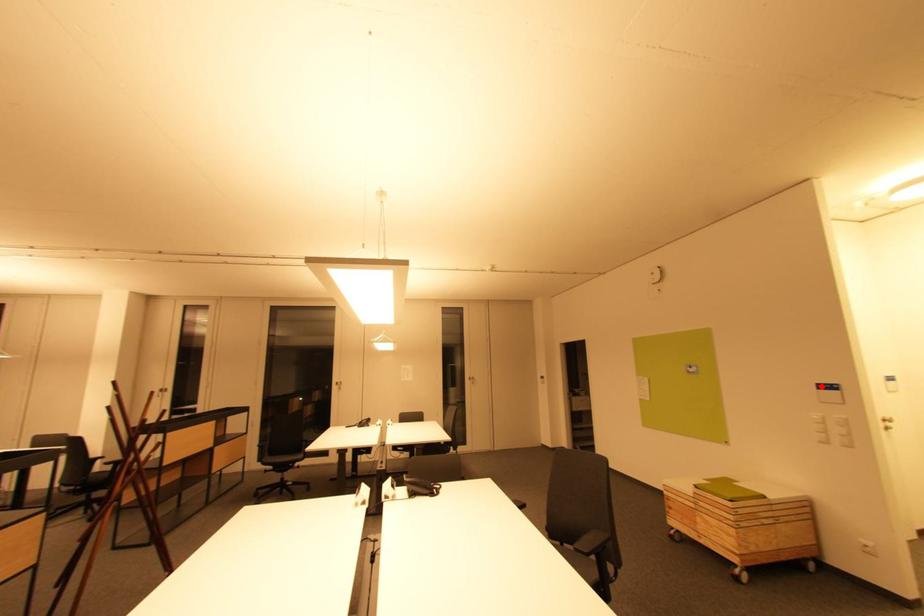
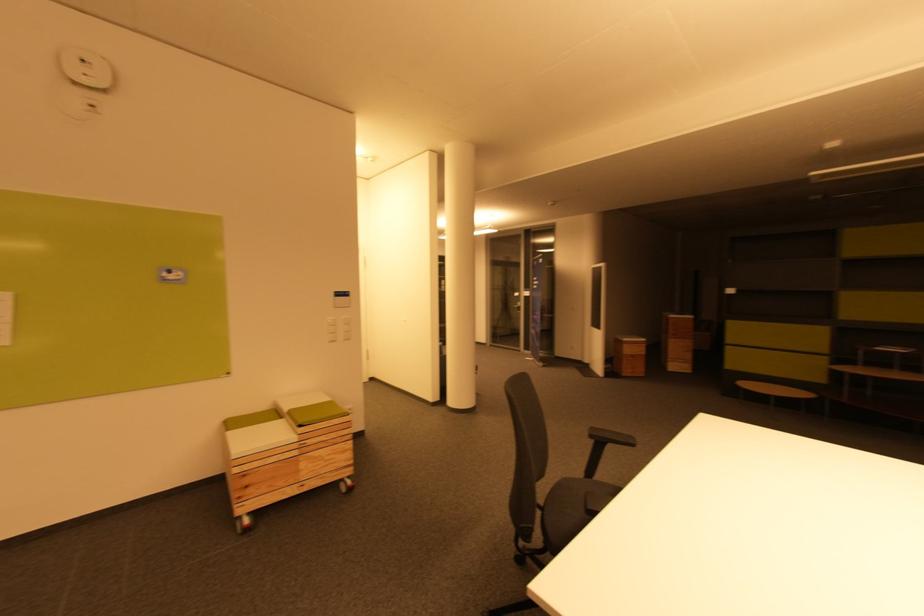
Locate, in the second image, the point that corresponds to the highlighted location in the first image.

(342, 294)